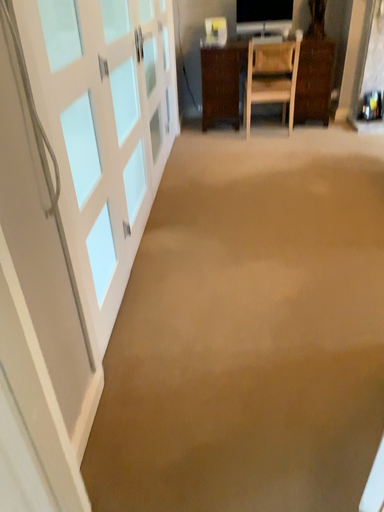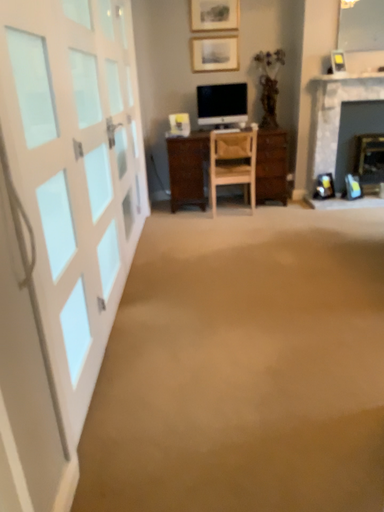
Question: How did the camera likely rotate when shooting the video?

Choices:
 (A) rotated upward
 (B) rotated downward

Answer: (A)